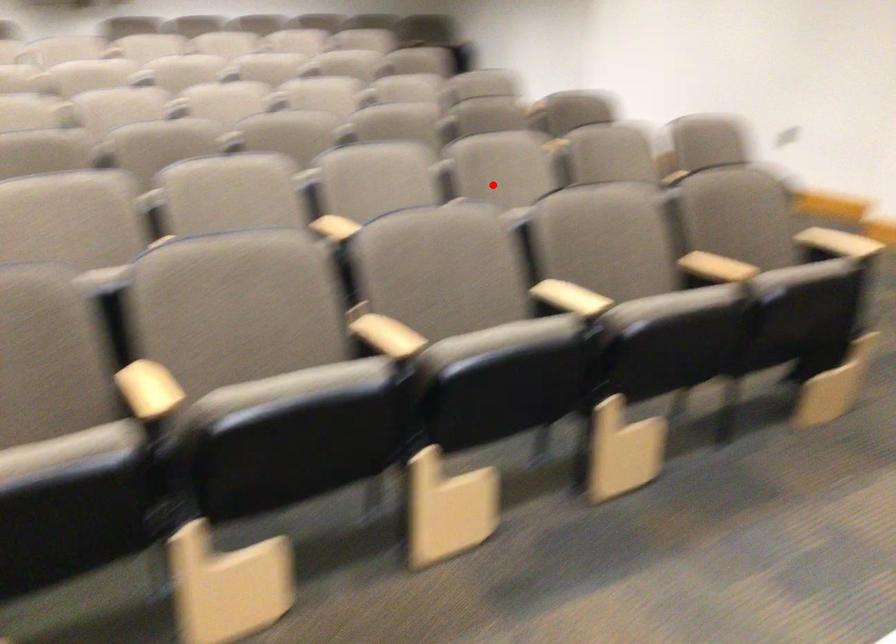
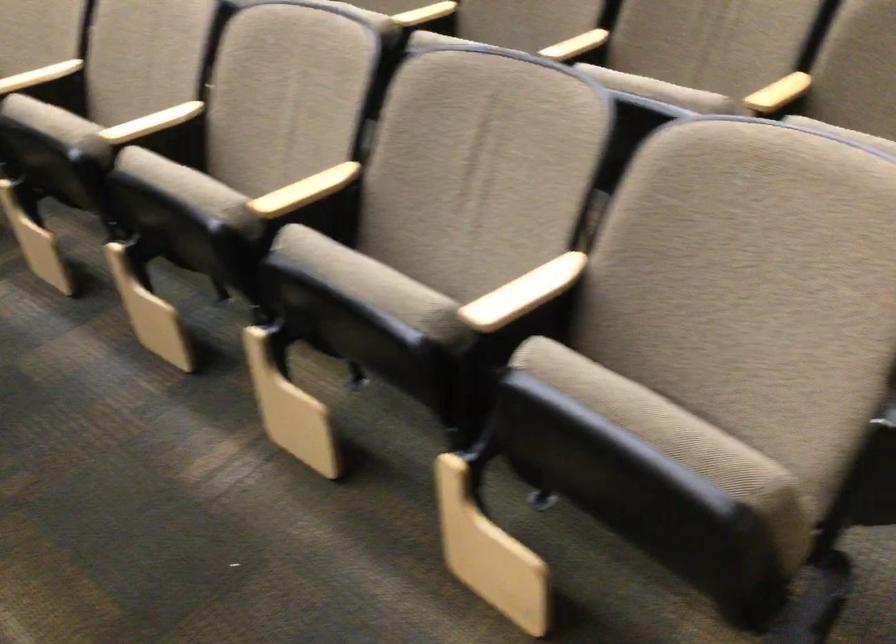
Find the pixel in the second image that matches the highlighted location in the first image.

(151, 122)